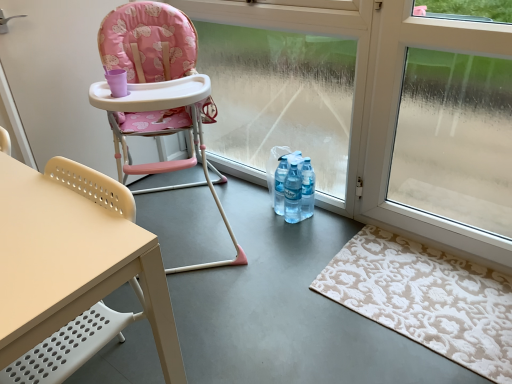
This screenshot has width=512, height=384. Identify the location of vacant area that lies between pink fabric highchair at left, marked as the 2th chair in a front-to-back arrangement, and transparent glass window at center. (263, 215).